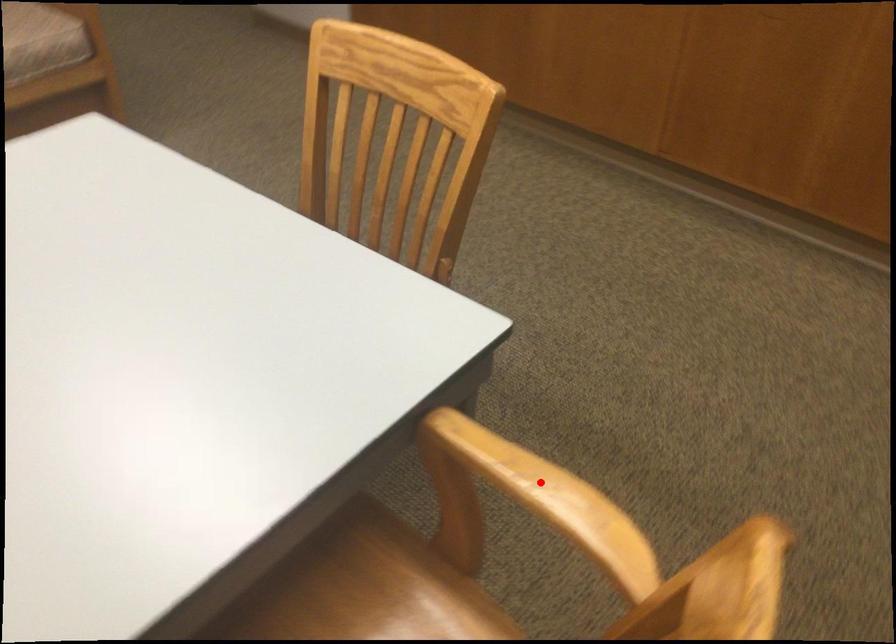
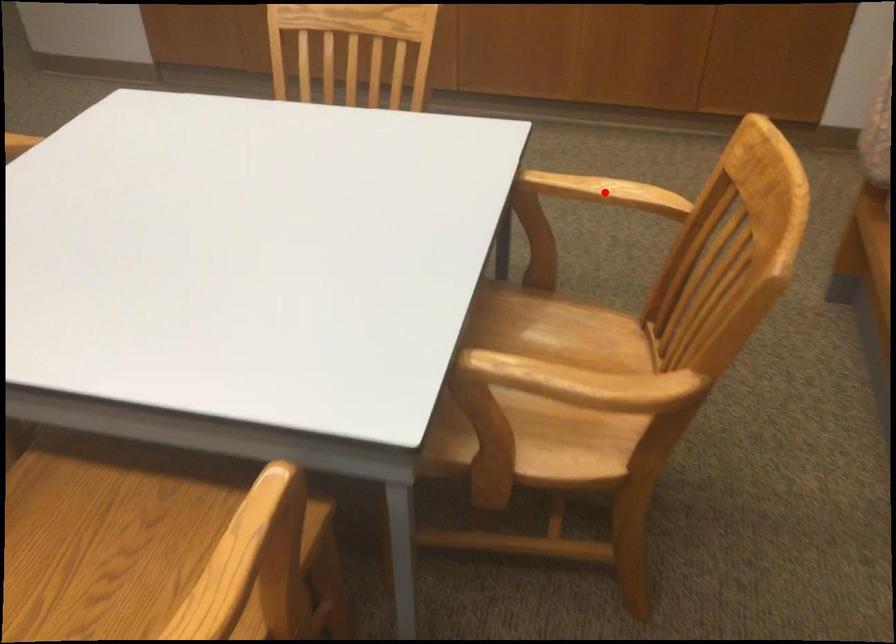
I am providing you with two images of the same scene from different viewpoints. A red point is marked on the first image and another point is marked on the second image. Is the red point in image1 aligned with the point shown in image2?

Yes